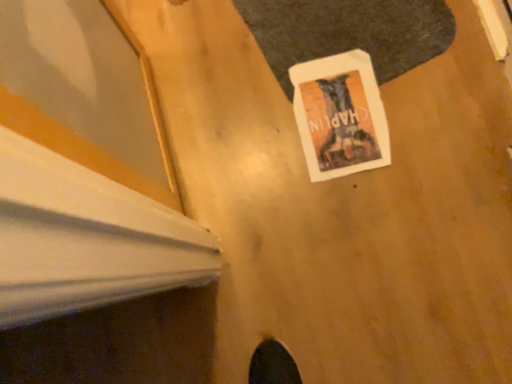
Question: Should I look upward or downward to see white paper at center?

Choices:
 (A) down
 (B) up

Answer: (B)

Question: From the image's perspective, is white paper at center above white paper at center?

Choices:
 (A) yes
 (B) no

Answer: (B)

Question: Is white paper at center taller than white paper at center?

Choices:
 (A) no
 (B) yes

Answer: (A)

Question: Is white paper at center looking in the opposite direction of white paper at center?

Choices:
 (A) no
 (B) yes

Answer: (A)

Question: Does white paper at center have a larger size compared to white paper at center?

Choices:
 (A) no
 (B) yes

Answer: (A)

Question: Is white paper at center in contact with white paper at center?

Choices:
 (A) no
 (B) yes

Answer: (A)

Question: Is white paper at center shorter than white paper at center?

Choices:
 (A) no
 (B) yes

Answer: (B)

Question: Is white paper at center positioned beyond the bounds of white paper at center?

Choices:
 (A) yes
 (B) no

Answer: (A)

Question: Is white paper at center further to camera compared to white paper at center?

Choices:
 (A) no
 (B) yes

Answer: (A)

Question: Could you tell me if white paper at center is turned towards white paper at center?

Choices:
 (A) no
 (B) yes

Answer: (A)

Question: Does white paper at center have a greater width compared to white paper at center?

Choices:
 (A) no
 (B) yes

Answer: (B)

Question: Can white paper at center be found inside white paper at center?

Choices:
 (A) no
 (B) yes

Answer: (B)

Question: Can you confirm if white paper at center is smaller than white paper at center?

Choices:
 (A) no
 (B) yes

Answer: (A)

Question: Looking at the image, does white paper at center seem bigger or smaller compared to white paper at center?

Choices:
 (A) small
 (B) big

Answer: (A)